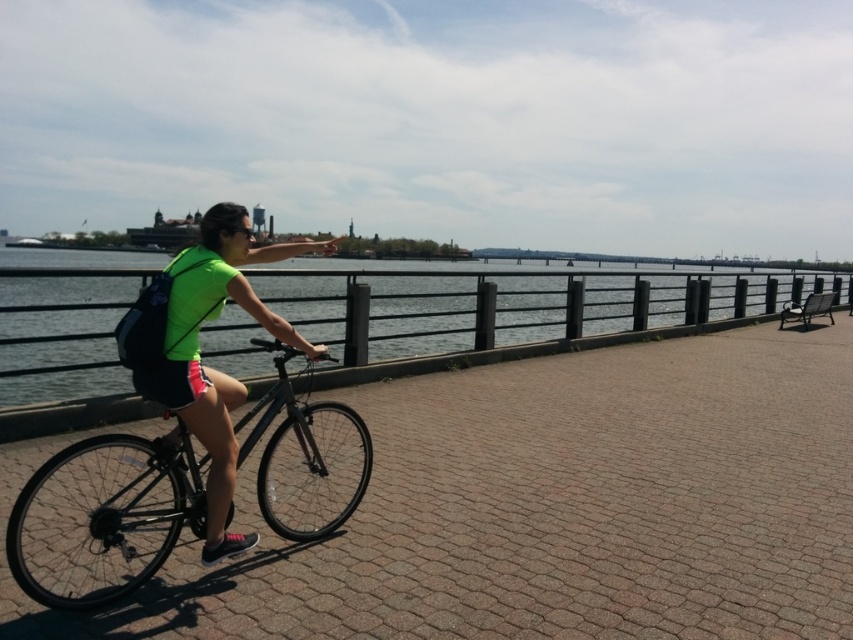
Is point (180, 497) positioned before point (212, 516)?

That is False.

Between point (177, 502) and point (175, 346), which one is positioned behind?

The point (177, 502) is more distant.

Is point (177, 467) closer to viewer compared to point (223, 285)?

No, (177, 467) is further to viewer.

The width and height of the screenshot is (853, 640). I want to click on shiny black bicycle at center, so click(x=105, y=516).

Does clear water at center appear under neon green fabric at center?

No, clear water at center is not below neon green fabric at center.

Looking at this image, does clear water at center have a larger size compared to neon green fabric at center?

Correct, clear water at center is larger in size than neon green fabric at center.

Who is more forward, (140, 266) or (323, 346)?

Point (323, 346) is more forward.

Identify the location of clear water at center. (61, 337).

Is clear water at center shorter than shiny black bicycle at center?

In fact, clear water at center may be taller than shiny black bicycle at center.

Describe the element at coordinates (61, 337) in the screenshot. I see `clear water at center` at that location.

Find the location of a particular element. The width and height of the screenshot is (853, 640). clear water at center is located at coordinates (61, 337).